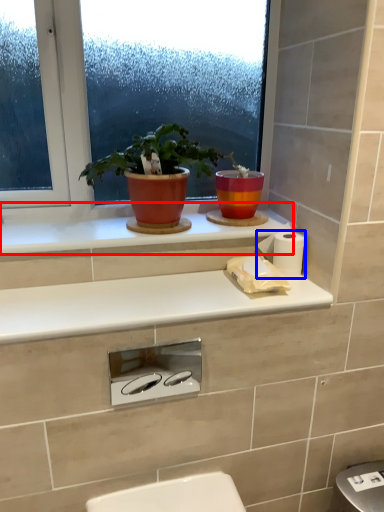
Question: Which point is closer to the camera, window sill (highlighted by a red box) or toilet paper (highlighted by a blue box)?

Choices:
 (A) window sill
 (B) toilet paper

Answer: (A)